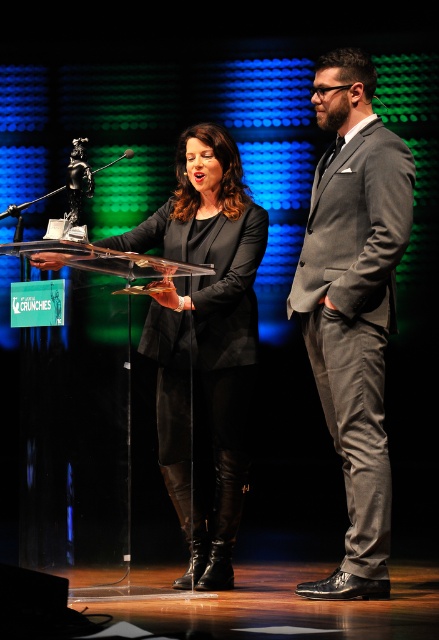
Question: Can you confirm if gray suit at right is bigger than matte black dress at center?

Choices:
 (A) no
 (B) yes

Answer: (A)

Question: Is gray suit at right smaller than matte black dress at center?

Choices:
 (A) yes
 (B) no

Answer: (A)

Question: From the image, what is the correct spatial relationship of gray suit at right in relation to matte black dress at center?

Choices:
 (A) below
 (B) above

Answer: (B)

Question: Among these points, which one is farthest from the camera?

Choices:
 (A) (231, 531)
 (B) (385, 579)

Answer: (A)

Question: Which of the following is the farthest from the observer?

Choices:
 (A) matte black dress at center
 (B) gray suit at right

Answer: (A)